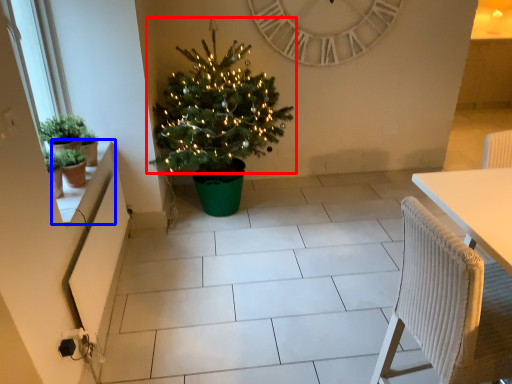
Question: Among these objects, which one is nearest to the camera, christmas tree (highlighted by a red box) or window sill (highlighted by a blue box)?

Choices:
 (A) christmas tree
 (B) window sill

Answer: (B)